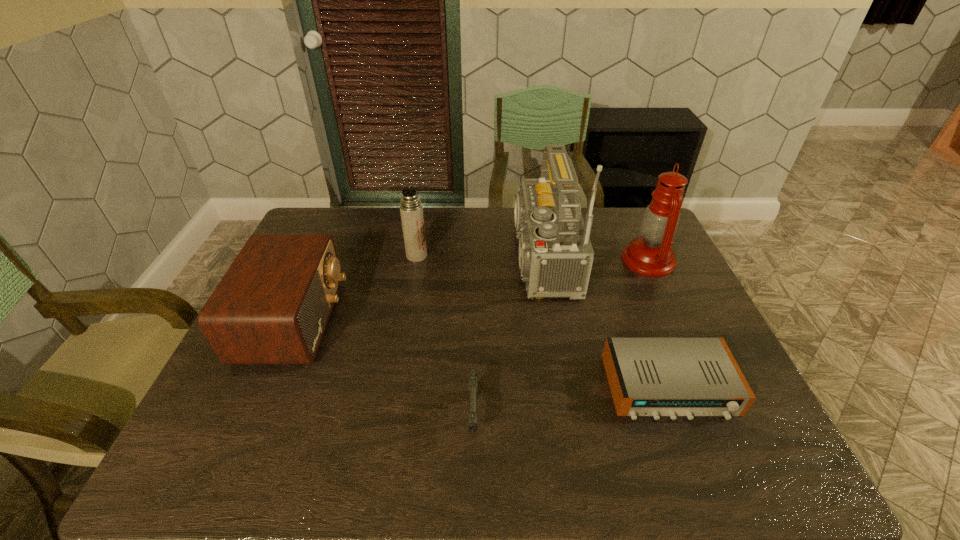
Locate an element on the screen. the second radio receiver from right to left is located at coordinates (555, 252).

In order to click on the tallest object in this screenshot , I will do `click(555, 252)`.

The width and height of the screenshot is (960, 540). I want to click on oil lamp, so click(x=651, y=254).

The width and height of the screenshot is (960, 540). I want to click on the third tallest object, so click(x=411, y=209).

You are a GUI agent. You are given a task and a screenshot of the screen. Output one action in this format:
    pyautogui.click(x=<x>, y=<y>)
    Task: Click on the fifth object from right to left
    The height and width of the screenshot is (540, 960).
    Given the screenshot: What is the action you would take?
    pyautogui.click(x=411, y=209)

Locate an element on the screen. This screenshot has height=540, width=960. the leftmost radio receiver is located at coordinates (272, 306).

Identify the location of the second tallest radio receiver. Image resolution: width=960 pixels, height=540 pixels. coord(272,306).

What are the coordinates of `the second shortest object` in the screenshot? It's located at (473, 376).

The height and width of the screenshot is (540, 960). Identify the location of the third object from left to right. (473, 376).

Where is `the rightmost radio receiver`? Image resolution: width=960 pixels, height=540 pixels. the rightmost radio receiver is located at coordinates (656, 377).